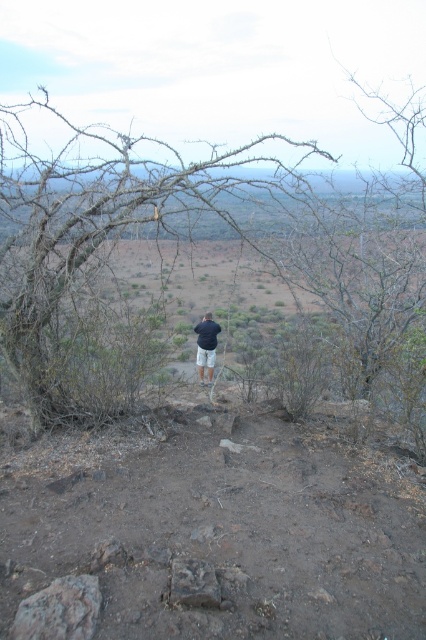
Question: Which of the following is the closest to the observer?

Choices:
 (A) dark blue shirt at center
 (B) brown dry branches at upper left

Answer: (B)

Question: Is brown dry branches at upper left smaller than dark blue shirt at center?

Choices:
 (A) no
 (B) yes

Answer: (A)

Question: Does brown dry branches at upper left appear under dark blue shirt at center?

Choices:
 (A) yes
 (B) no

Answer: (B)

Question: Can you confirm if brown dry branches at upper left is positioned to the left of dark blue shirt at center?

Choices:
 (A) yes
 (B) no

Answer: (A)

Question: Which object is closer to the camera taking this photo?

Choices:
 (A) dark blue shirt at center
 (B) brown dry branches at upper left

Answer: (B)